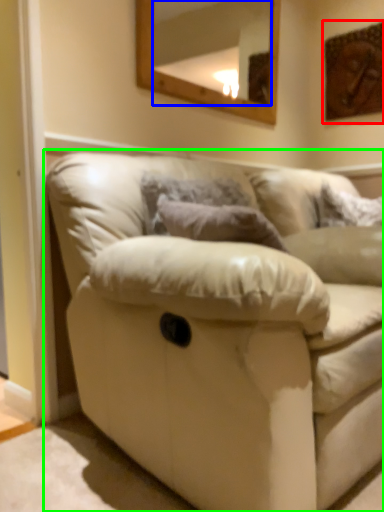
Question: Which object is positioned farthest from picture frame (highlighted by a red box)? Select from mirror (highlighted by a blue box) and studio couch (highlighted by a green box).

Choices:
 (A) mirror
 (B) studio couch

Answer: (B)